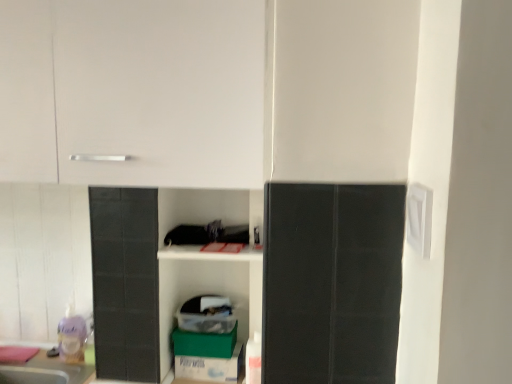
Question: Considering their positions, is white matte cabinet at upper left located in front of or behind green cardboard box at lower center, positioned as the first cardboard box in bottom-to-top order?

Choices:
 (A) front
 (B) behind

Answer: (A)

Question: Looking at the image, does white matte cabinet at upper left seem bigger or smaller compared to green cardboard box at lower center, positioned as the first cardboard box in bottom-to-top order?

Choices:
 (A) big
 (B) small

Answer: (A)

Question: Considering the real-world distances, which object is closest to the green cardboard box at lower center, positioned as the first cardboard box in bottom-to-top order?

Choices:
 (A) translucent plastic toy at lower left
 (B) white matte cabinet at upper left
 (C) green cardboard box at lower center, arranged as the second cardboard box when ordered from the bottom

Answer: (C)

Question: Estimate the real-world distances between objects in this image. Which object is closer to the green cardboard box at lower center, positioned as the first cardboard box in bottom-to-top order?

Choices:
 (A) translucent plastic toy at lower left
 (B) green cardboard box at lower center, arranged as the second cardboard box when ordered from the bottom
 (C) white matte cabinet at upper left

Answer: (B)